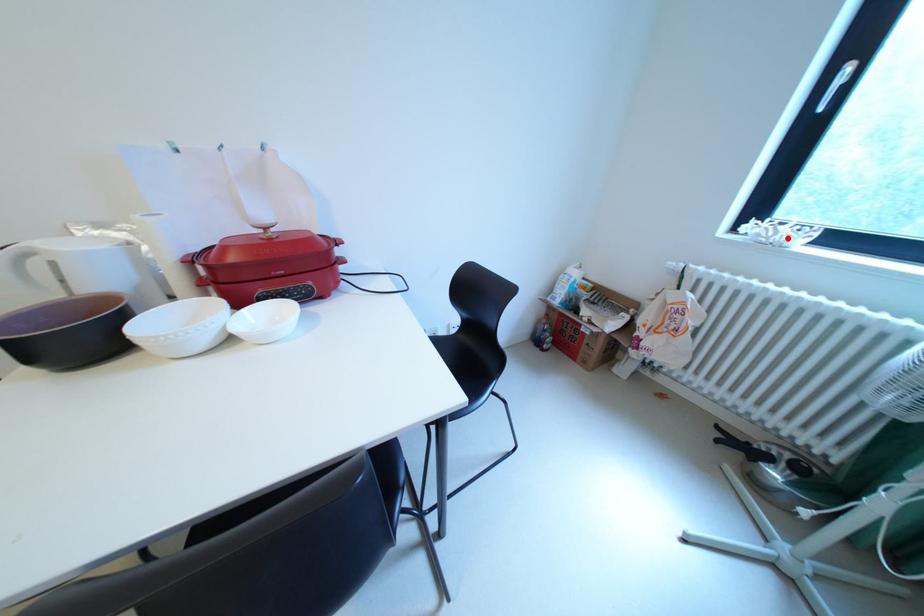
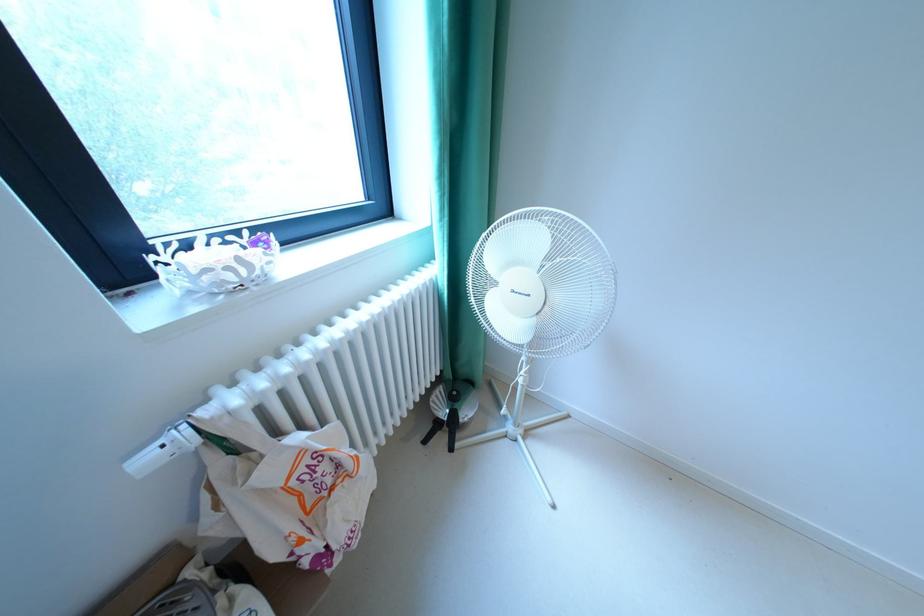
The point at the highlighted location is marked in the first image. Where is the corresponding point in the second image?

(268, 273)